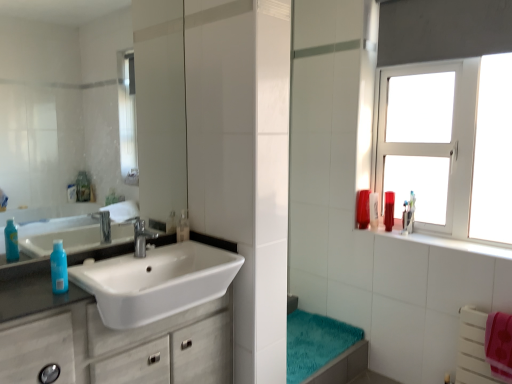
The width and height of the screenshot is (512, 384). Find the location of `vacant point to the right of translucent plastic mouthwash at sink, the 4th mouthwash viewed from the back`. vacant point to the right of translucent plastic mouthwash at sink, the 4th mouthwash viewed from the back is located at coordinates (201, 238).